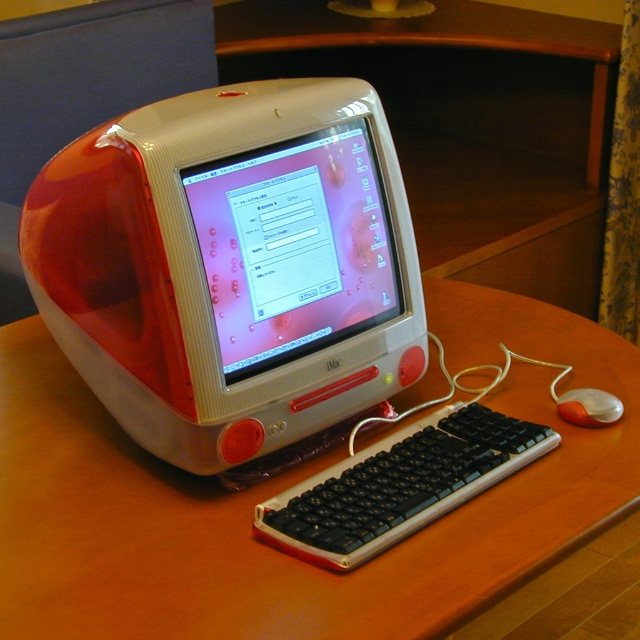
You are setting up a desk and need to place the white glossy monitor at center and the orange matte mouse at lower right. Based on the image, which object is positioned higher up?

The white glossy monitor at center is positioned higher up than the orange matte mouse at lower right.